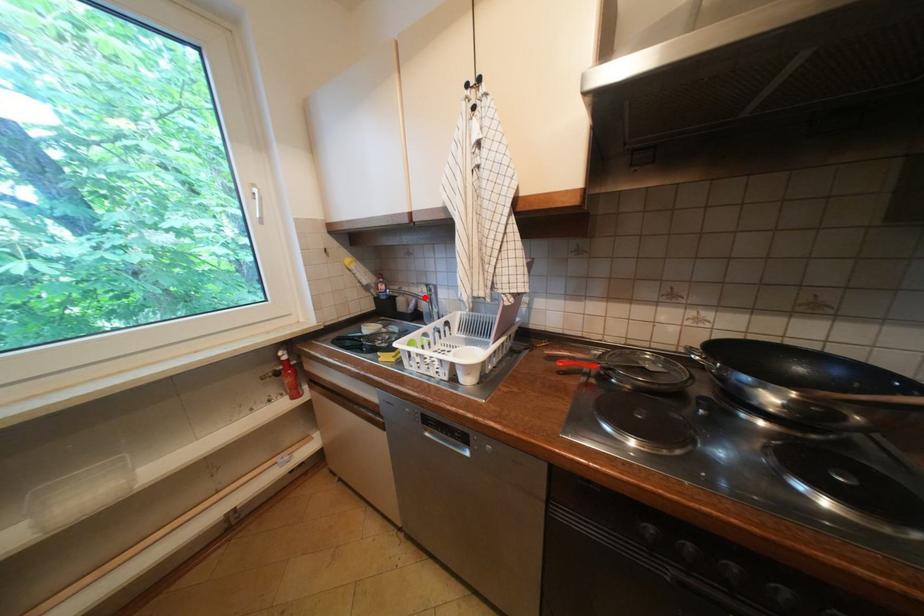
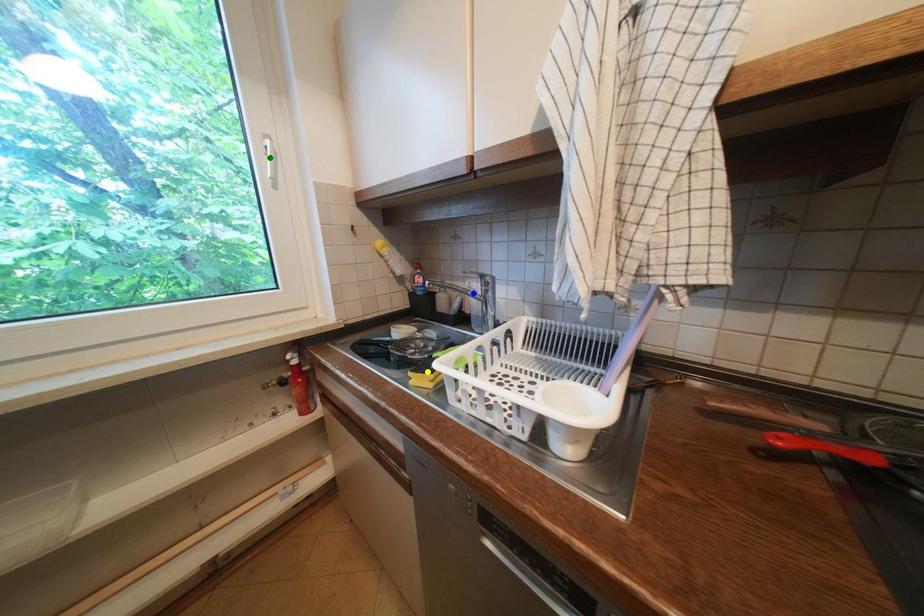
Question: I am providing you with two images of the same scene from different viewpoints. A red point is marked on the first image. You are given multiple points on the second image. Which spot in image 2 lines up with the point in image 1?

Choices:
 (A) yellow point
 (B) green point
 (C) blue point

Answer: (C)